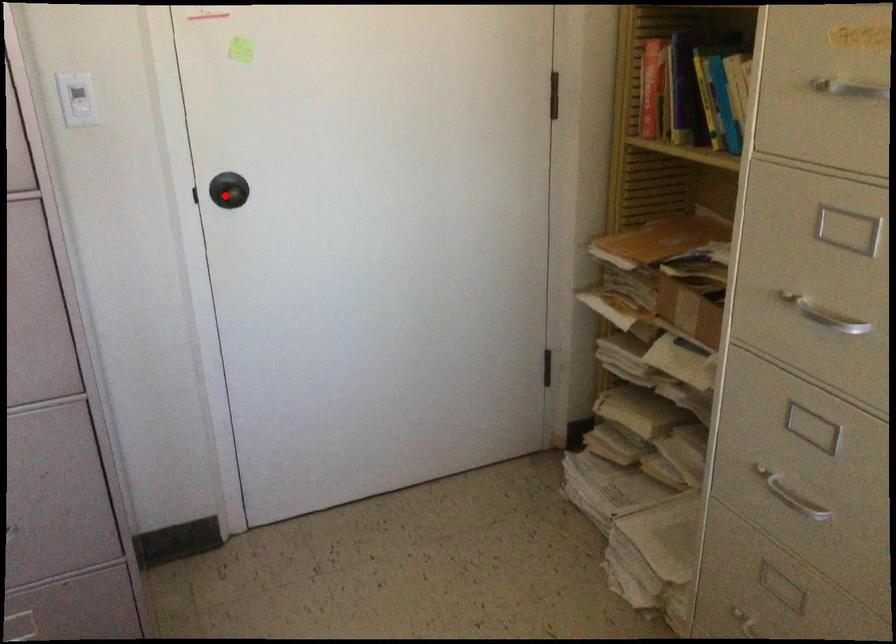
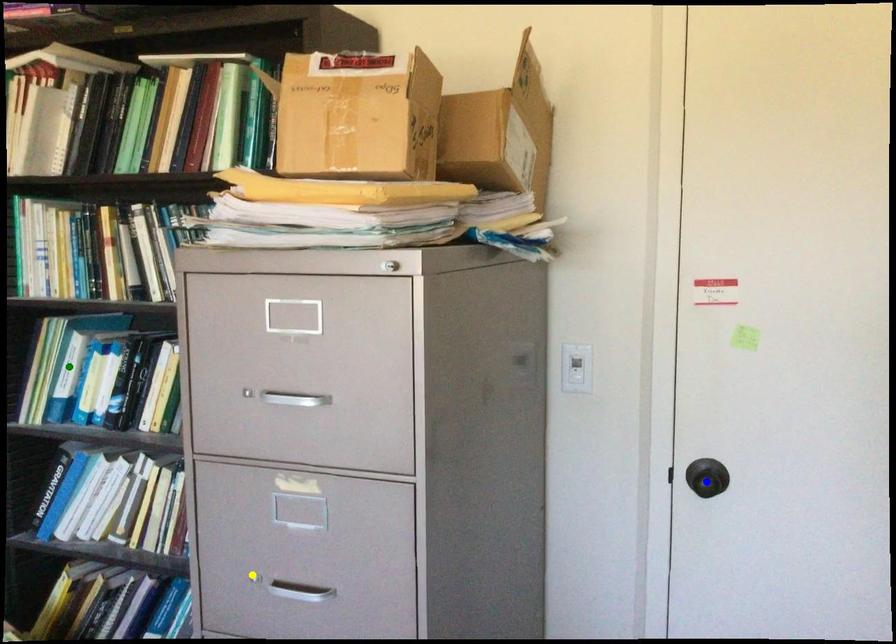
Question: I am providing you with two images of the same scene from different viewpoints. A red point is marked on the first image. You are given multiple points on the second image. Which point in image 2 represents the same 3d spot as the red point in image 1?

Choices:
 (A) green point
 (B) yellow point
 (C) blue point

Answer: (C)